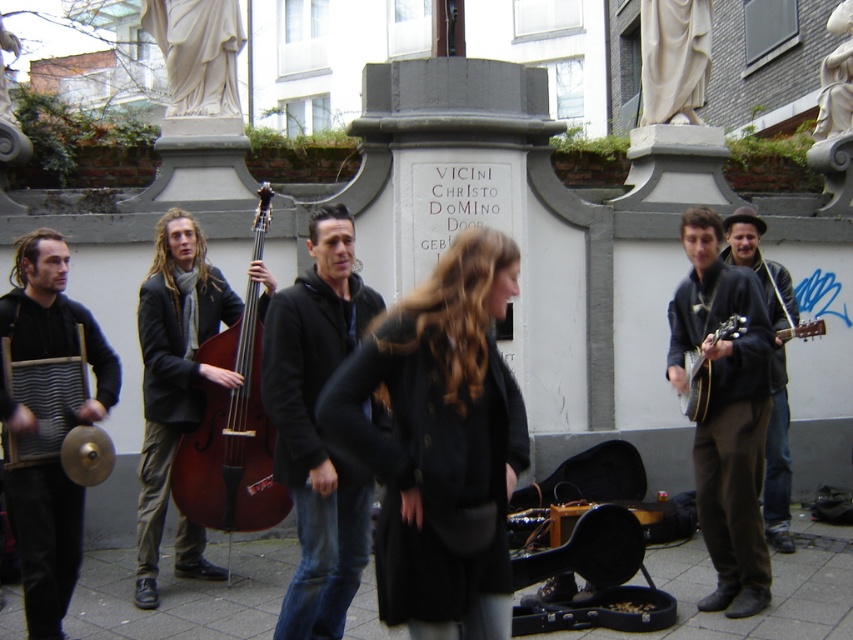
You are a photographer standing in front of the musicians. You want to take a photo that includes both the black matte jacket at center and the matte black washboard at left. Which object will appear larger in the photo?

The black matte jacket at center will appear larger in the photo because it is much taller than the matte black washboard at left.

You are a photographer standing 6 meters away from the mahogany wood cello at center. You want to take a photo of the cello and include the camera in the frame. Is the camera close enough to be in the shot?

The mahogany wood cello at center and camera are 6.45 meters apart from each other. Since you are 6 meters away from the cello, the camera is only 0.45 meters further away, so it should be within the frame.

You are standing at the camera position. Which musician is closest to you? The one with the washboard, the double bass, or the one at point (x=331, y=305)?

The musician at point (x=331, y=305) is 5.53 meters away from the camera, so they are the closest among the three.